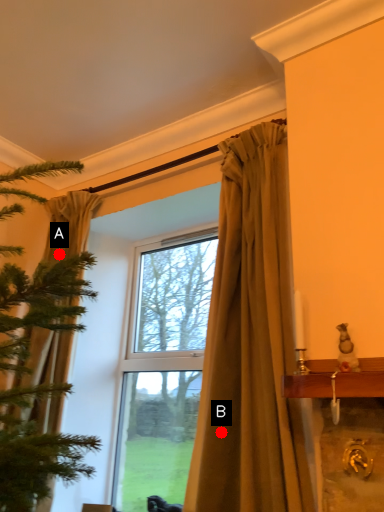
Question: Two points are circled on the image, labeled by A and B beside each circle. Among these points, which one is nearest to the camera?

Choices:
 (A) A is closer
 (B) B is closer

Answer: (B)